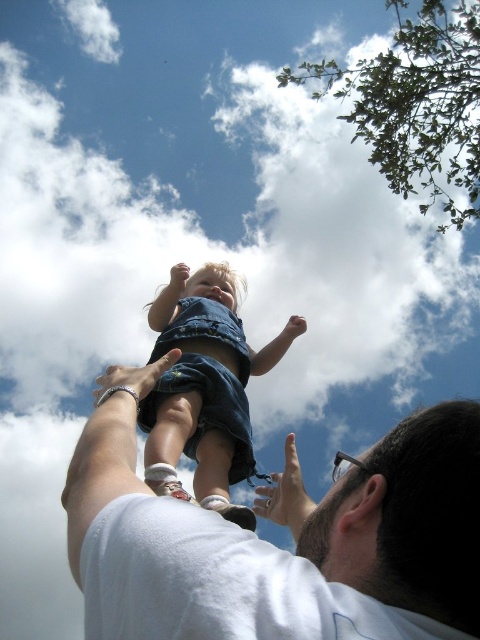
Question: Is white cotton shirt at upper center to the right of white matte hand at upper center from the viewer's perspective?

Choices:
 (A) yes
 (B) no

Answer: (B)

Question: Observing the image, what is the correct spatial positioning of denim shorts at center in reference to white matte hand at upper center?

Choices:
 (A) below
 (B) above

Answer: (B)

Question: Which point is closer to the camera?

Choices:
 (A) matte skin hand at upper center
 (B) denim shorts at center
 (C) white cotton shirt at upper center

Answer: (C)

Question: Estimate the real-world distances between objects in this image. Which object is closer to the smooth skin hand at upper center?

Choices:
 (A) white matte hand at upper center
 (B) matte skin hand at upper center

Answer: (B)

Question: Can you confirm if white cotton shirt at upper center is positioned to the left of matte skin hand at upper center?

Choices:
 (A) yes
 (B) no

Answer: (A)

Question: Considering the real-world distances, which object is closest to the smooth skin hand at upper center?

Choices:
 (A) white cotton shirt at upper center
 (B) matte skin hand at upper center
 (C) white matte hand at upper center
 (D) denim shorts at center

Answer: (B)